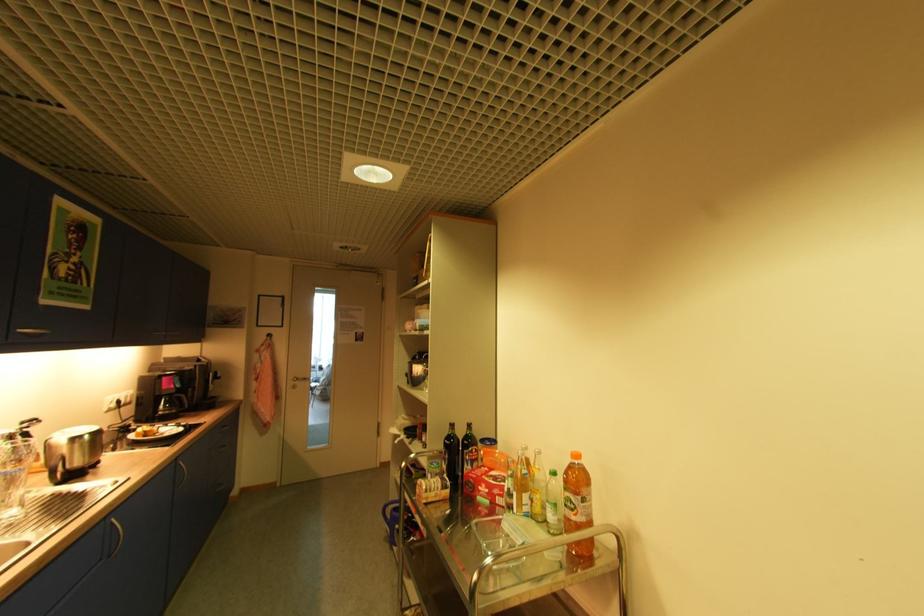
Identify the location of cart handle. (403, 483).